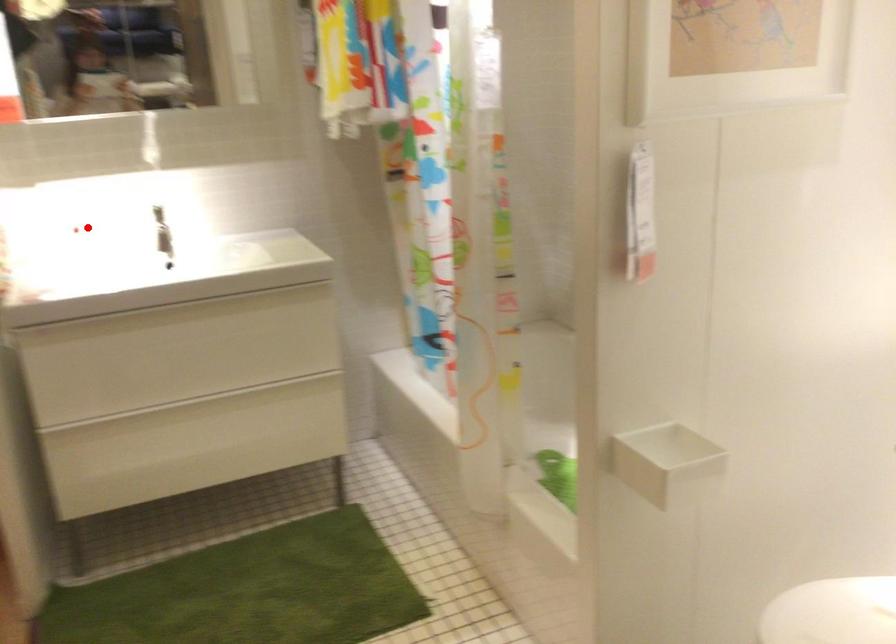
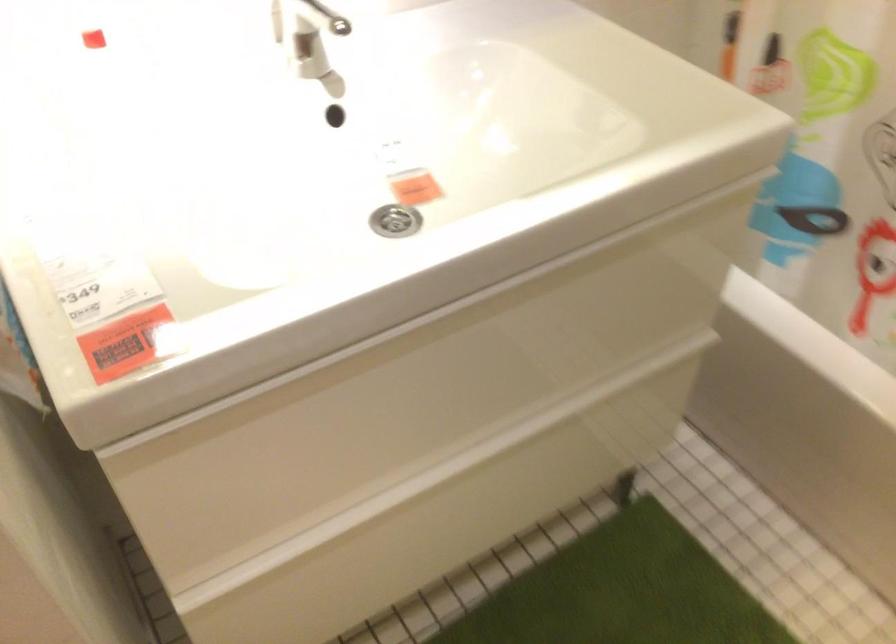
Where in the second image is the point corresponding to the highlighted location from the first image?

(92, 39)